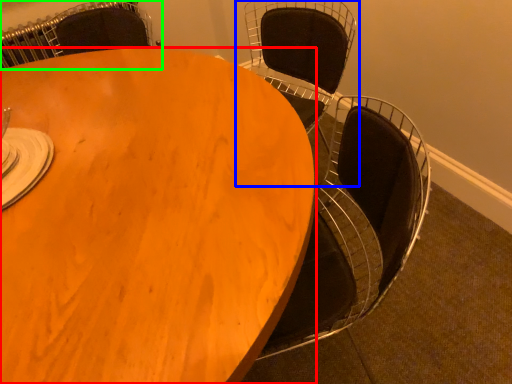
Question: Based on their relative distances, which object is nearer to table (highlighted by a red box)? Choose from chair (highlighted by a blue box) and chair (highlighted by a green box).

Choices:
 (A) chair
 (B) chair

Answer: (A)